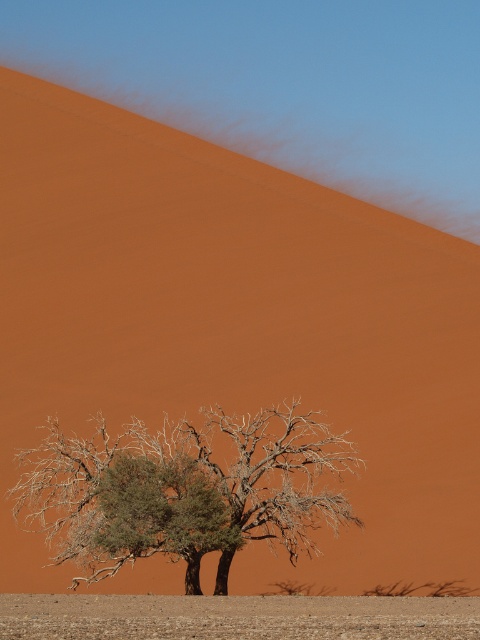
Does green leafy tree at lower center have a lesser height compared to brown sandy ground at lower center?

No.

Can you confirm if green leafy tree at lower center is taller than brown sandy ground at lower center?

Yes, green leafy tree at lower center is taller than brown sandy ground at lower center.

Where is `green leafy tree at lower center`? The width and height of the screenshot is (480, 640). green leafy tree at lower center is located at coordinates (183, 490).